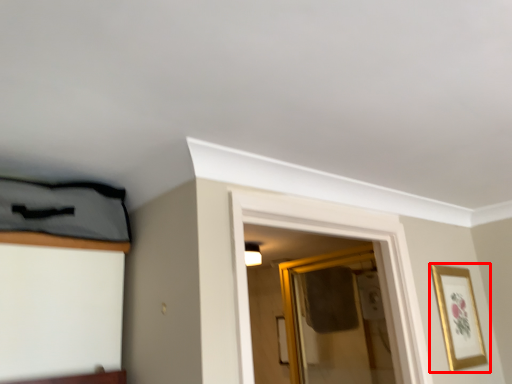
Question: From the image's perspective, considering the relative positions of picture frame (annotated by the red box) and glass door in the image provided, where is picture frame (annotated by the red box) located with respect to the staircase?

Choices:
 (A) above
 (B) below

Answer: (A)